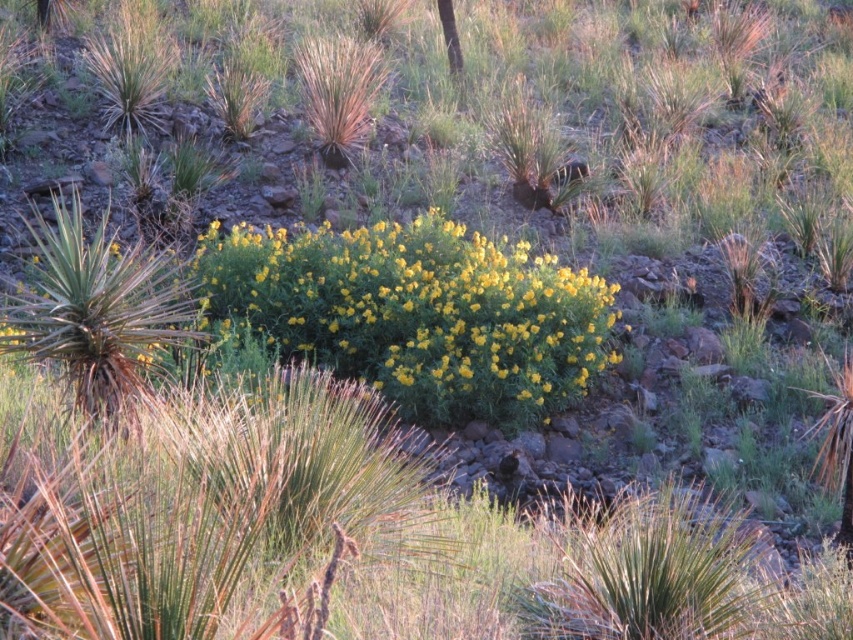
Question: Where is yellow-green leafy bush at center located in relation to green leafy tree at upper center in the image?

Choices:
 (A) above
 (B) below

Answer: (B)

Question: In this image, where is yellow-green leafy bush at center located relative to green leafy tree at upper center?

Choices:
 (A) left
 (B) right

Answer: (A)

Question: Can you confirm if yellow-green leafy bush at center is bigger than green leafy tree at upper center?

Choices:
 (A) yes
 (B) no

Answer: (A)

Question: Which point is closer to the camera?

Choices:
 (A) yellow-green leafy bush at center
 (B) green leafy tree at upper center

Answer: (A)